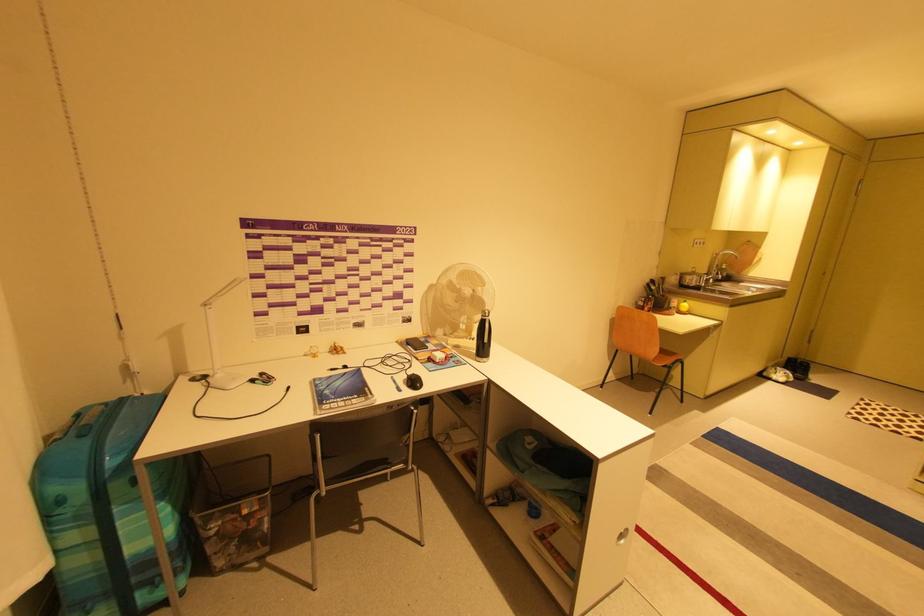
Find where to lift the metal faucet handle. Please return your answer as a coordinate pair (x, y).

(716, 275)